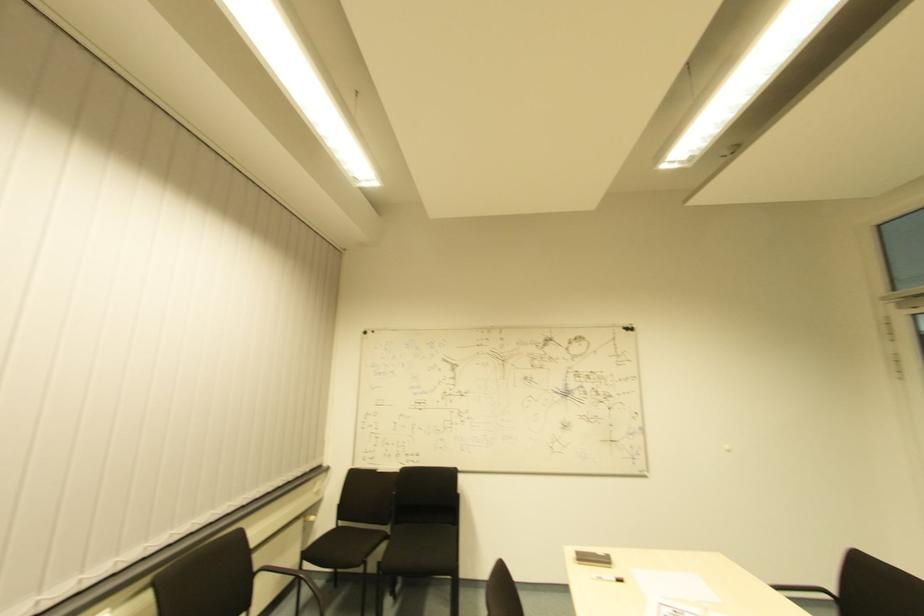
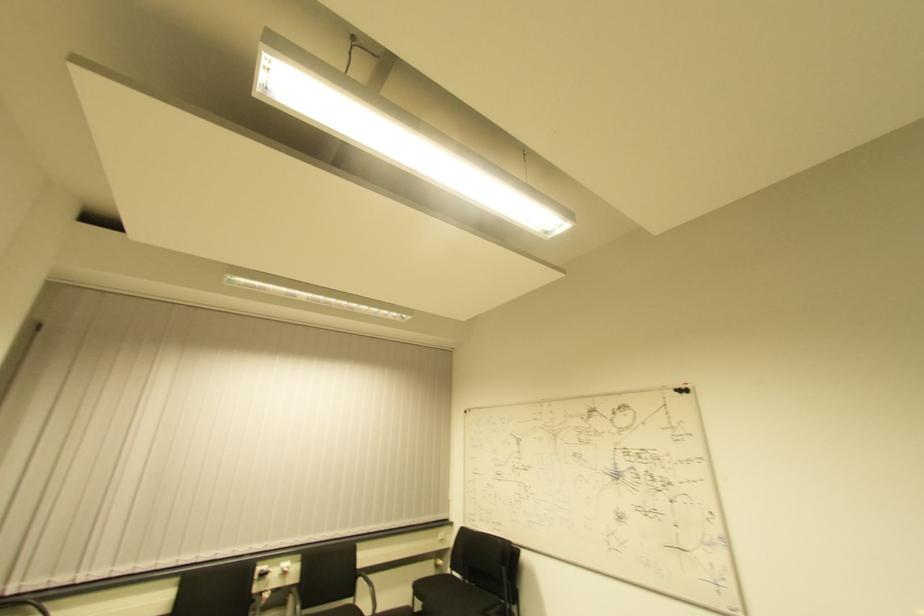
Find the pixel in the second image that matches [326,471] in the first image.

(450, 527)